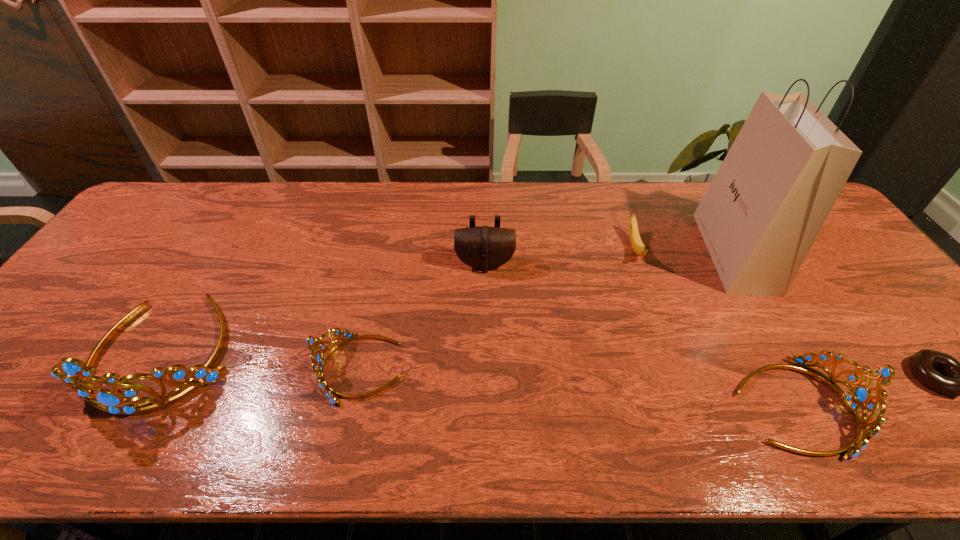
Locate an element on the screen. free region that satisfies the following two spatial constraints: 1. at the stem of the shopping bag; 2. on the left side of the banana is located at coordinates (636, 252).

Identify the location of vacant space that satisfies the following two spatial constraints: 1. at the stem of the fourth object from left to right; 2. on the front-facing side of the shortest tiara. (678, 369).